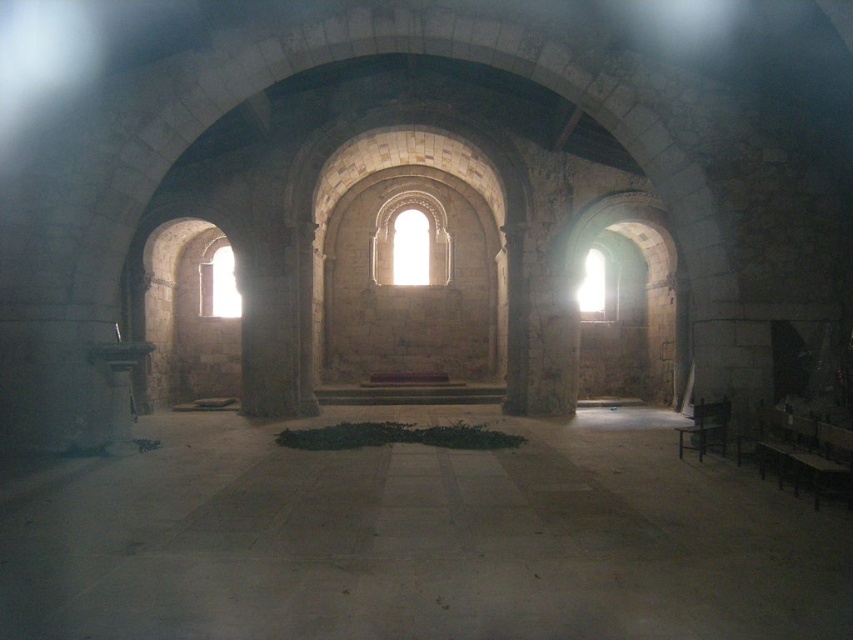
Can you confirm if smooth stone floor at center is positioned above translucent stone window at center?

No, smooth stone floor at center is not above translucent stone window at center.

This screenshot has height=640, width=853. What do you see at coordinates (418, 540) in the screenshot?
I see `smooth stone floor at center` at bounding box center [418, 540].

At what (x,y) coordinates should I click in order to perform the action: click on smooth stone floor at center. Please return your answer as a coordinate pair (x, y). The height and width of the screenshot is (640, 853). Looking at the image, I should click on (418, 540).

Between point (712, 548) and point (213, 257), which one is positioned in front?

Point (712, 548)

Which is below, smooth stone floor at center or transparent glass window at left?

smooth stone floor at center

Image resolution: width=853 pixels, height=640 pixels. Find the location of `smooth stone floor at center`. smooth stone floor at center is located at coordinates (418, 540).

This screenshot has width=853, height=640. I want to click on smooth stone floor at center, so click(418, 540).

Does translucent stone window at center have a smaller size compared to transparent glass window at left?

Yes, translucent stone window at center is smaller than transparent glass window at left.

Does point (386, 248) come farther from viewer compared to point (200, 310)?

Yes, point (386, 248) is behind point (200, 310).

Describe the element at coordinates (409, 241) in the screenshot. This screenshot has height=640, width=853. I see `translucent stone window at center` at that location.

Where is `translucent stone window at center`? translucent stone window at center is located at coordinates (409, 241).